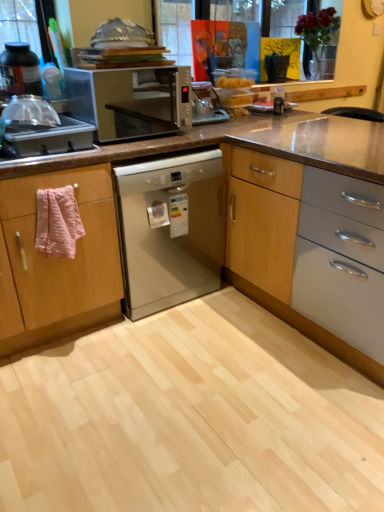
Question: Can you confirm if pink textured towel at left is bigger than metallic silver microwave at center?

Choices:
 (A) yes
 (B) no

Answer: (B)

Question: Is pink textured towel at left positioned before metallic silver microwave at center?

Choices:
 (A) yes
 (B) no

Answer: (A)

Question: From the image's perspective, is pink textured towel at left on top of metallic silver microwave at center?

Choices:
 (A) yes
 (B) no

Answer: (B)

Question: Is pink textured towel at left next to metallic silver microwave at center?

Choices:
 (A) yes
 (B) no

Answer: (B)

Question: Is metallic silver microwave at center inside pink textured towel at left?

Choices:
 (A) yes
 (B) no

Answer: (B)

Question: From a real-world perspective, relative to metallic silver microwave at center, is satin silver dishwasher at center vertically above or below?

Choices:
 (A) above
 (B) below

Answer: (B)

Question: Which is correct: satin silver dishwasher at center is inside metallic silver microwave at center, or outside of it?

Choices:
 (A) inside
 (B) outside

Answer: (B)

Question: From the image's perspective, is satin silver dishwasher at center positioned above or below metallic silver microwave at center?

Choices:
 (A) below
 (B) above

Answer: (A)

Question: From their relative heights in the image, would you say satin silver dishwasher at center is taller or shorter than metallic silver microwave at center?

Choices:
 (A) short
 (B) tall

Answer: (B)

Question: Based on their positions, is pink textured towel at left located to the left or right of metallic silver microwave at center?

Choices:
 (A) right
 (B) left

Answer: (B)

Question: Is pink textured towel at left spatially inside metallic silver microwave at center, or outside of it?

Choices:
 (A) outside
 (B) inside

Answer: (A)

Question: From the image's perspective, relative to metallic silver microwave at center, is pink textured towel at left above or below?

Choices:
 (A) above
 (B) below

Answer: (B)

Question: From a real-world perspective, is pink textured towel at left positioned above or below metallic silver microwave at center?

Choices:
 (A) below
 (B) above

Answer: (A)

Question: From the image's perspective, is metallic silver microwave at center above or below matte black bottle at left, marked as the first kitchen appliance in a top-to-bottom arrangement?

Choices:
 (A) above
 (B) below

Answer: (B)

Question: Is metallic silver microwave at center in front of or behind matte black bottle at left, which is the 2th kitchen appliance from bottom to top, in the image?

Choices:
 (A) behind
 (B) front

Answer: (B)